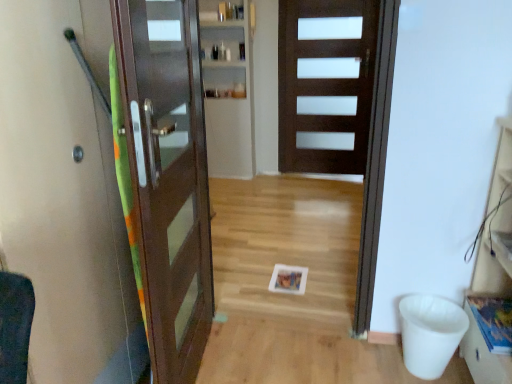
Question: Considering the positions of green fabric elevator at left and matte brown door at left, placed as the 1th door when sorted from left to right, in the image, is green fabric elevator at left taller or shorter than matte brown door at left, placed as the 1th door when sorted from left to right,?

Choices:
 (A) short
 (B) tall

Answer: (B)

Question: Which is correct: green fabric elevator at left is inside matte brown door at left, which is the 2th door in right-to-left order, or outside of it?

Choices:
 (A) outside
 (B) inside

Answer: (A)

Question: Which of these objects is positioned farthest from the matte brown door at left, placed as the 1th door when sorted from left to right?

Choices:
 (A) dark wood door at center, positioned as the 1th door in right-to-left order
 (B) green fabric elevator at left
 (C) wooden drawer at lower right

Answer: (A)

Question: Which object is the farthest from the matte brown door at left, placed as the 1th door when sorted from left to right?

Choices:
 (A) wooden drawer at lower right
 (B) green fabric elevator at left
 (C) dark wood door at center, positioned as the 1th door in right-to-left order

Answer: (C)